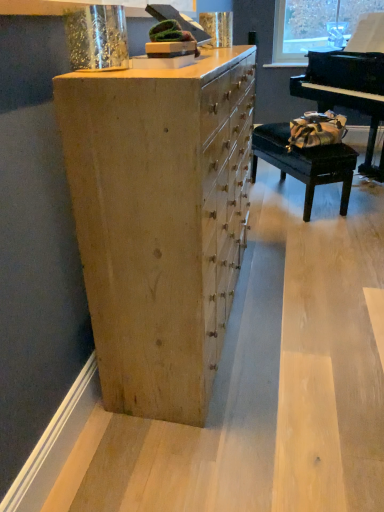
At what (x,y) coordinates should I click in order to perform the action: click on vacant space that is in between natural wood chest of drawers at center and black leather table at right. Please return your answer as a coordinate pair (x, y). The image size is (384, 512). Looking at the image, I should click on (281, 260).